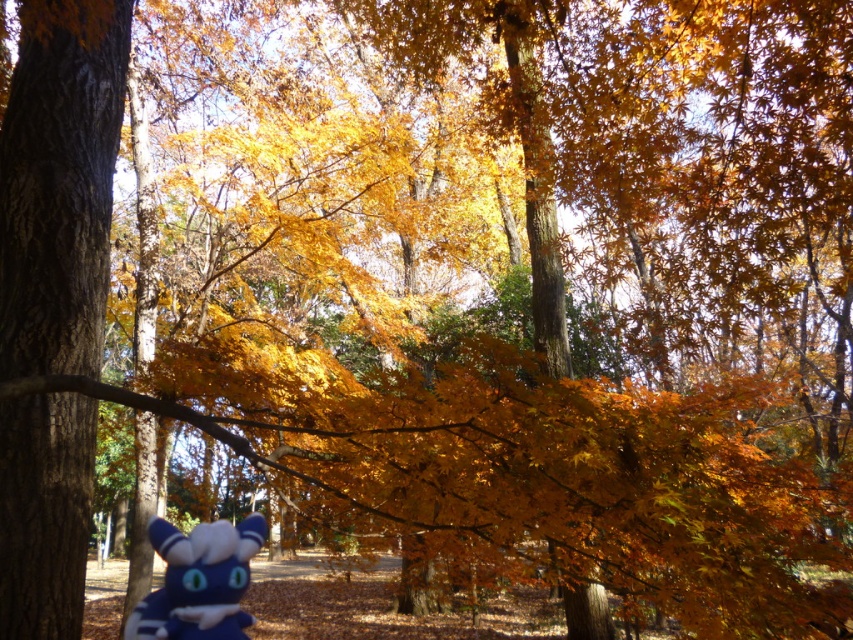
Does brown rough bark tree at left have a smaller size compared to blue plush toy at lower center?

Incorrect, brown rough bark tree at left is not smaller in size than blue plush toy at lower center.

Between point (32, 424) and point (155, 524), which one is positioned in front?

Point (32, 424) is more forward.

Locate an element on the screen. This screenshot has height=640, width=853. brown rough bark tree at left is located at coordinates (59, 182).